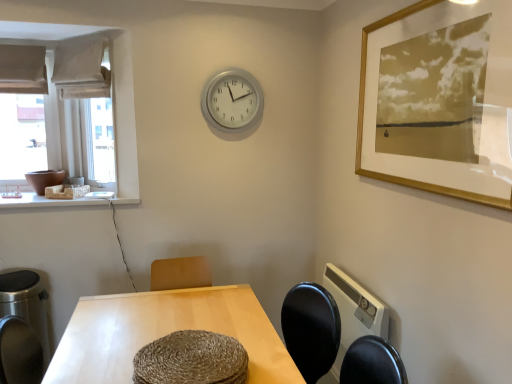
Where is `vacant area on top of light wood table at center (from a real-world perspective)`? vacant area on top of light wood table at center (from a real-world perspective) is located at coordinates (167, 327).